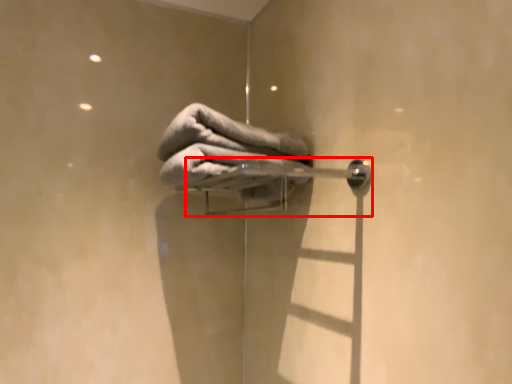
Question: From the image's perspective, where is door handle (annotated by the red box) located relative to towel?

Choices:
 (A) below
 (B) above

Answer: (A)